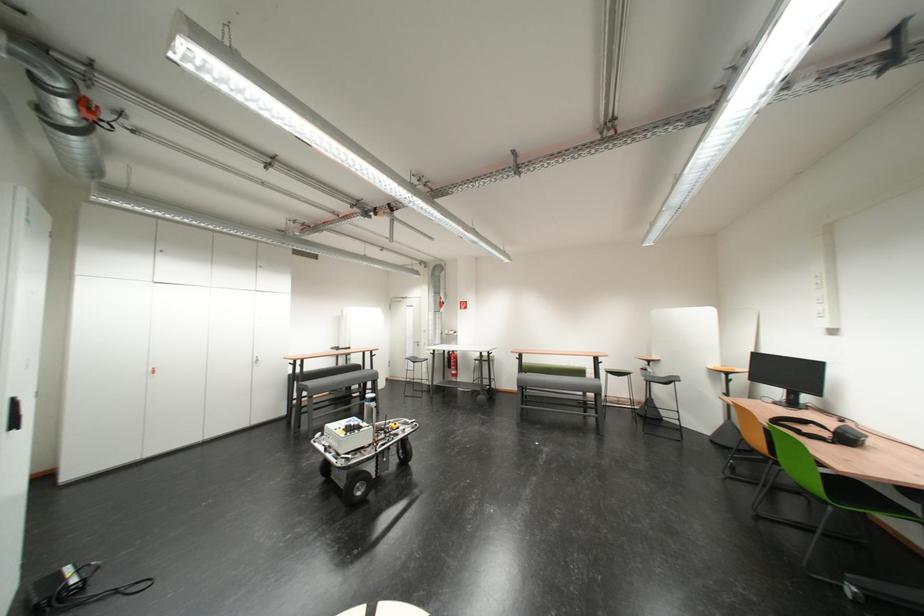
Describe the element at coordinates (27, 216) in the screenshot. I see `a blue button` at that location.